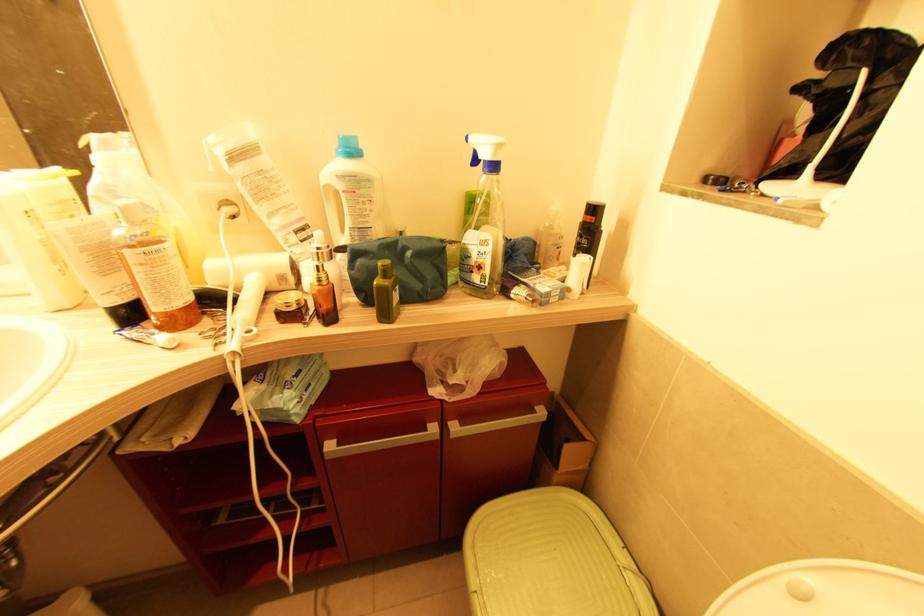
Where is `gold dropper top`? Image resolution: width=924 pixels, height=616 pixels. gold dropper top is located at coordinates pyautogui.click(x=833, y=132).